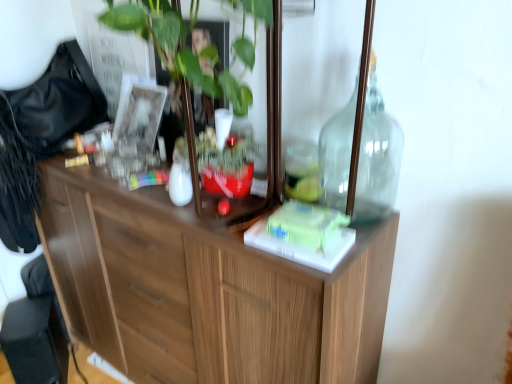
Question: Is transparent glass bottle at upper right placed right next to wooden cabinet at center?

Choices:
 (A) no
 (B) yes

Answer: (A)

Question: Can you confirm if transparent glass bottle at upper right is smaller than wooden cabinet at center?

Choices:
 (A) yes
 (B) no

Answer: (A)

Question: Can you confirm if transparent glass bottle at upper right is wider than wooden cabinet at center?

Choices:
 (A) no
 (B) yes

Answer: (A)

Question: Does transparent glass bottle at upper right come behind wooden cabinet at center?

Choices:
 (A) no
 (B) yes

Answer: (B)

Question: Is transparent glass bottle at upper right not near wooden cabinet at center?

Choices:
 (A) no
 (B) yes

Answer: (A)

Question: From their relative heights in the image, would you say transparent glass bottle at upper right is taller or shorter than black plastic swivel chair at lower left?

Choices:
 (A) short
 (B) tall

Answer: (B)

Question: From the image's perspective, is transparent glass bottle at upper right positioned above or below black plastic swivel chair at lower left?

Choices:
 (A) above
 (B) below

Answer: (A)

Question: From a real-world perspective, is transparent glass bottle at upper right physically located above or below black plastic swivel chair at lower left?

Choices:
 (A) above
 (B) below

Answer: (A)

Question: Considering the positions of transparent glass bottle at upper right and black plastic swivel chair at lower left in the image, is transparent glass bottle at upper right bigger or smaller than black plastic swivel chair at lower left?

Choices:
 (A) small
 (B) big

Answer: (A)

Question: Considering the positions of wooden cabinet at center and transparent glass bottle at upper right in the image, is wooden cabinet at center taller or shorter than transparent glass bottle at upper right?

Choices:
 (A) tall
 (B) short

Answer: (A)

Question: Based on their positions, is wooden cabinet at center located to the left or right of transparent glass bottle at upper right?

Choices:
 (A) left
 (B) right

Answer: (A)

Question: Do you think wooden cabinet at center is within transparent glass bottle at upper right, or outside of it?

Choices:
 (A) inside
 (B) outside

Answer: (B)

Question: In terms of size, does wooden cabinet at center appear bigger or smaller than transparent glass bottle at upper right?

Choices:
 (A) small
 (B) big

Answer: (B)

Question: Is wooden cabinet at center wider or thinner than black plastic swivel chair at lower left?

Choices:
 (A) wide
 (B) thin

Answer: (A)

Question: From a real-world perspective, is wooden cabinet at center above or below black plastic swivel chair at lower left?

Choices:
 (A) below
 (B) above

Answer: (B)